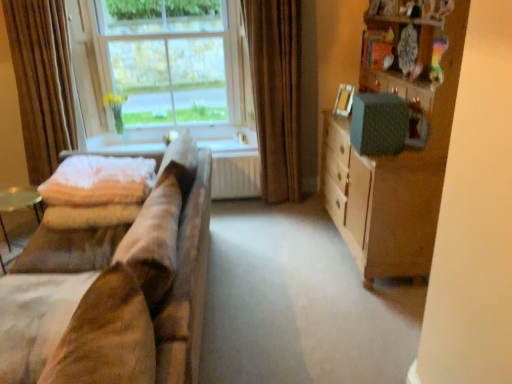
At what (x,y) coordinates should I click in order to perform the action: click on free space that is in between suede-like beige couch at left and wooden cabinet at right. Please return your answer as a coordinate pair (x, y). Looking at the image, I should click on (292, 280).